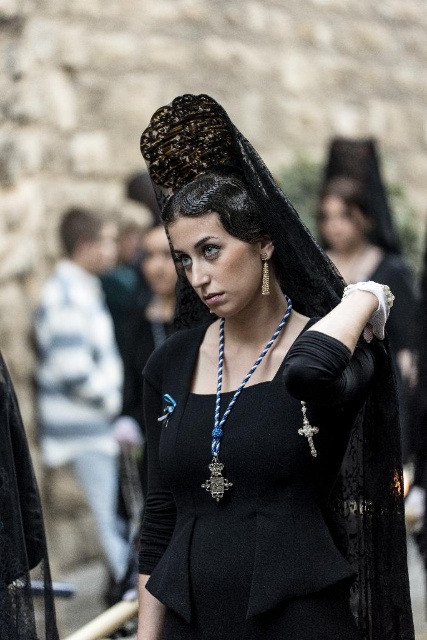
You are a fashion designer observing the woman in the scene. You need to determine if the black woolen dress at center can fit over the blue corded necklace at center without adjusting the necklace. Based on their widths, what is your conclusion?

The black woolen dress at center is wider than the blue corded necklace at center, so the dress can fit over the necklace without needing to adjust it.

Looking at this image, you are a fashion designer observing the woman in the image. You need to determine if the blue corded necklace at center can be comfortably worn over the black woolen dress at center. Based on their sizes, what is your conclusion?

The black woolen dress at center has a larger size compared to the blue corded necklace at center, so the necklace can be comfortably worn over the dress as it is smaller in size.

You are a photographer standing at the camera position. You want to take a closeup shot of the black woolen dress at center. Considering the distance, can you capture it clearly without zooming?

The black woolen dress at center is 38.94 meters from camera, so it would be too far to capture clearly without zooming.